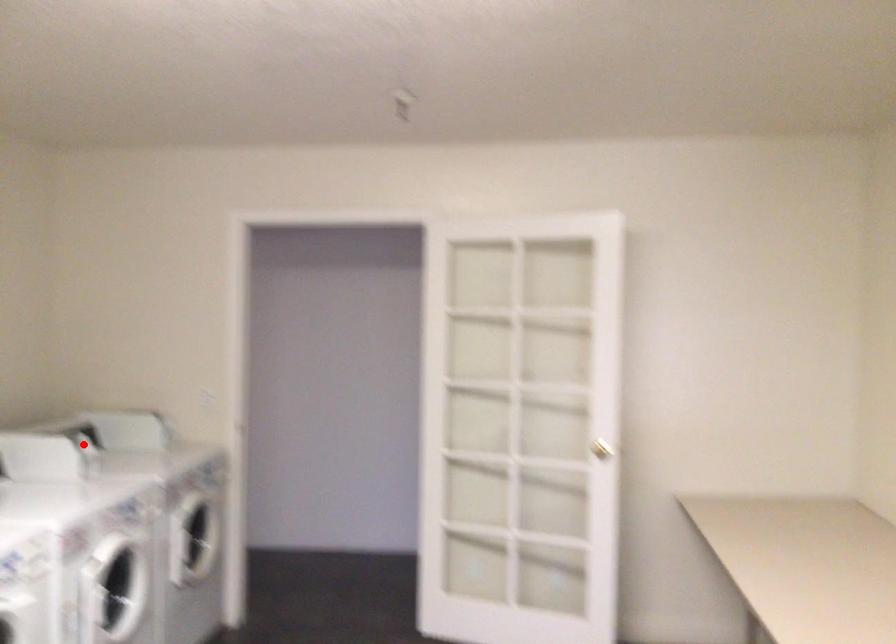
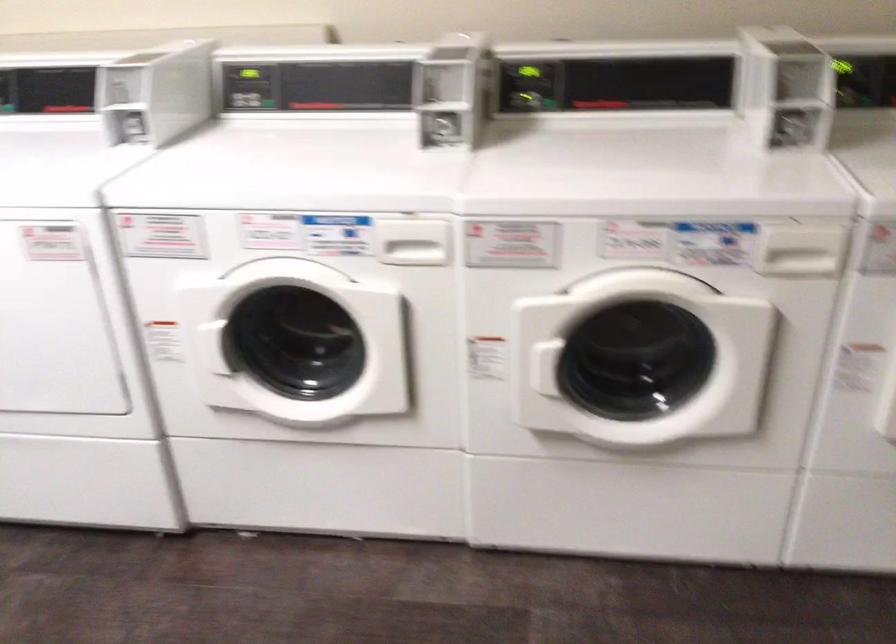
Find the pixel in the second image that matches the highlighted location in the first image.

(794, 80)